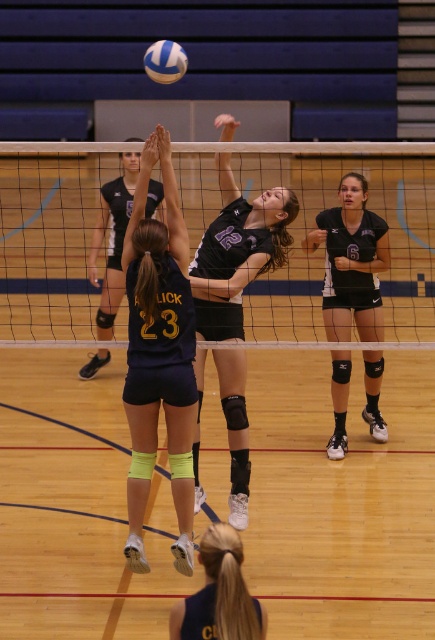
What are the coordinates of `black mesh net at center` in the screenshot? It's located at (311, 227).

Who is higher up, black mesh net at center or black matte uniform at center?

black mesh net at center

This screenshot has height=640, width=435. Find the location of `black mesh net at center`. black mesh net at center is located at coordinates (311, 227).

Identify the location of black mesh net at center. (311, 227).

Is black matte uniform at center bigger than black jersey at center?

Incorrect, black matte uniform at center is not larger than black jersey at center.

Measure the distance between black matte uniform at center and camera.

7.86 meters

Measure the distance between black matte uniform at center and camera.

black matte uniform at center and camera are 7.86 meters apart.

You are a GUI agent. You are given a task and a screenshot of the screen. Output one action in this format:
    pyautogui.click(x=<x>, y=<y>)
    Task: Click on the black matte uniform at center
    The image size is (435, 640).
    Given the screenshot: What is the action you would take?
    pyautogui.click(x=351, y=262)

Which is above, black mesh net at center or matte black jersey at center?

black mesh net at center is higher up.

Does black mesh net at center have a smaller size compared to matte black jersey at center?

Actually, black mesh net at center might be larger than matte black jersey at center.

Which is in front, point (39, 179) or point (194, 460)?

Point (194, 460) is in front.

At what (x,y) coordinates should I click in order to perform the action: click on black mesh net at center. Please return your answer as a coordinate pair (x, y). This screenshot has width=435, height=640. Looking at the image, I should click on (311, 227).